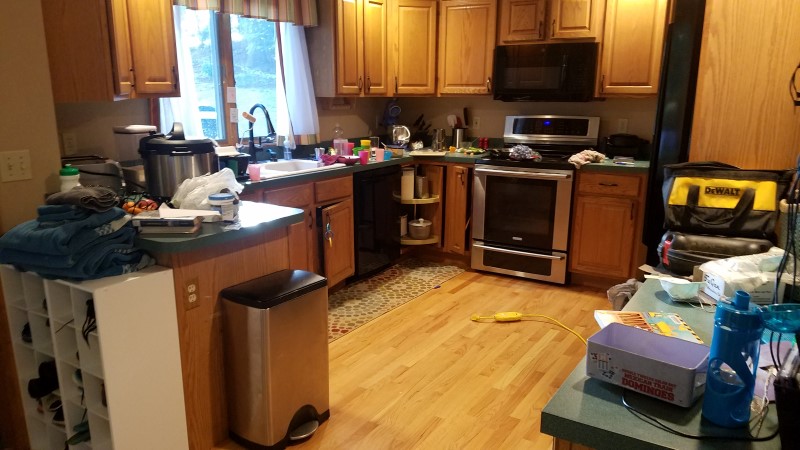
Where is `folded towels`? The height and width of the screenshot is (450, 800). folded towels is located at coordinates (97, 244).